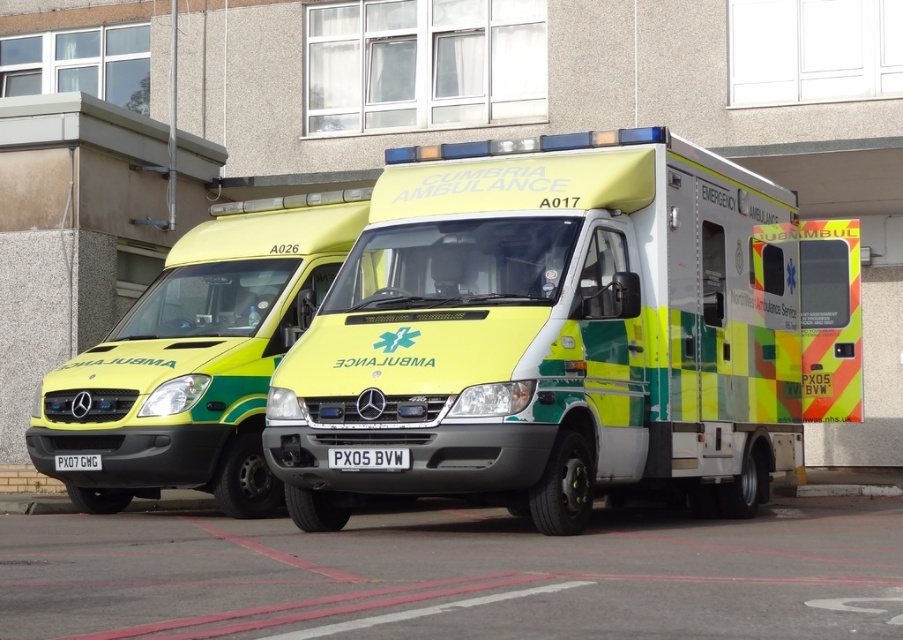
Between yellow/green plastic ambulance at center and yellow-green glossy ambulance at center, which one has more height?

With more height is yellow-green glossy ambulance at center.

Is yellow/green plastic ambulance at center shorter than yellow-green glossy ambulance at center?

Correct, yellow/green plastic ambulance at center is not as tall as yellow-green glossy ambulance at center.

This screenshot has width=903, height=640. Describe the element at coordinates (550, 333) in the screenshot. I see `yellow/green plastic ambulance at center` at that location.

Where is `yellow/green plastic ambulance at center`? The width and height of the screenshot is (903, 640). yellow/green plastic ambulance at center is located at coordinates (550, 333).